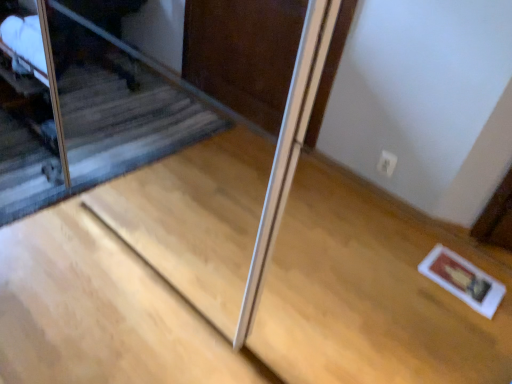
In order to click on white soft bed at upper left in this screenshot , I will do coord(53,89).

What do you see at coordinates (53, 89) in the screenshot?
I see `white soft bed at upper left` at bounding box center [53, 89].

At what (x,y) coordinates should I click in order to perform the action: click on white soft bed at upper left. Please return your answer as a coordinate pair (x, y). Looking at the image, I should click on (53, 89).